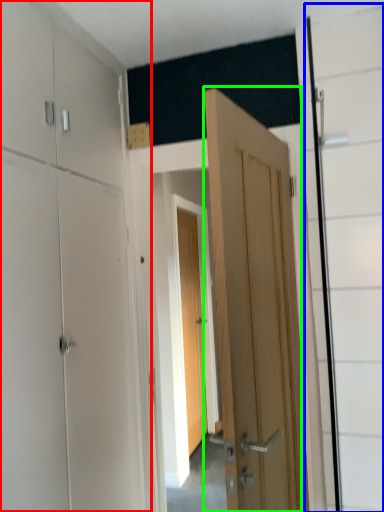
Question: Which is farther away from dresser (highlighted by a red box)? glass door (highlighted by a blue box) or door (highlighted by a green box)?

Choices:
 (A) glass door
 (B) door

Answer: (A)